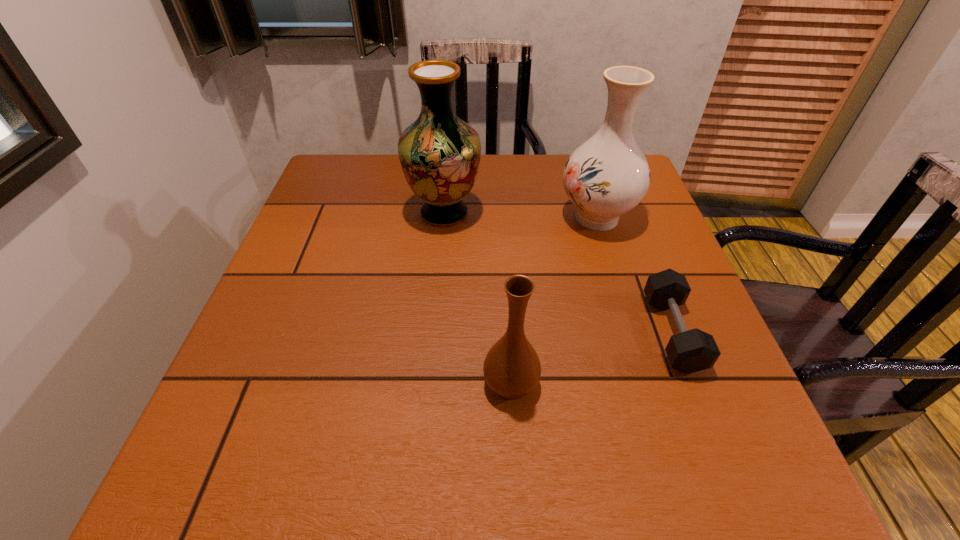
What are the coordinates of `dumbbell situated at the right edge` in the screenshot? It's located at (689, 351).

The image size is (960, 540). In order to click on object that is at the far right corner in this screenshot , I will do `click(608, 175)`.

At what (x,y) coordinates should I click in order to perform the action: click on vacant space at the far edge of the desktop. Please return your answer as a coordinate pair (x, y). The image size is (960, 540). Looking at the image, I should click on (397, 187).

At what (x,y) coordinates should I click in order to perform the action: click on vacant area at the near edge. Please return your answer as a coordinate pair (x, y). The image size is (960, 540). Looking at the image, I should click on (558, 451).

Find the location of `free location at the left edge`. free location at the left edge is located at coordinates (319, 368).

Where is `blank space at the right edge of the desktop`? blank space at the right edge of the desktop is located at coordinates (649, 310).

This screenshot has height=540, width=960. In order to click on vacant space at the far left corner in this screenshot , I will do `click(367, 179)`.

The image size is (960, 540). What are the coordinates of `empty space between the dumbbell and the shortest vase` in the screenshot? It's located at (591, 358).

Image resolution: width=960 pixels, height=540 pixels. Identify the location of vacant space in between the rightmost vase and the leftmost object. (520, 215).

Image resolution: width=960 pixels, height=540 pixels. I want to click on empty location between the leftmost vase and the third object from right to left, so click(477, 298).